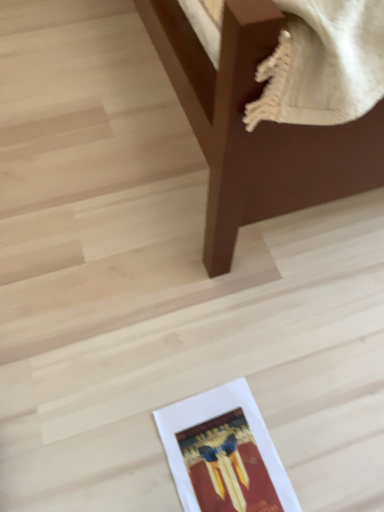
The height and width of the screenshot is (512, 384). Identify the location of vacant area to the right of matte paper paperback book at lower center. (322, 437).